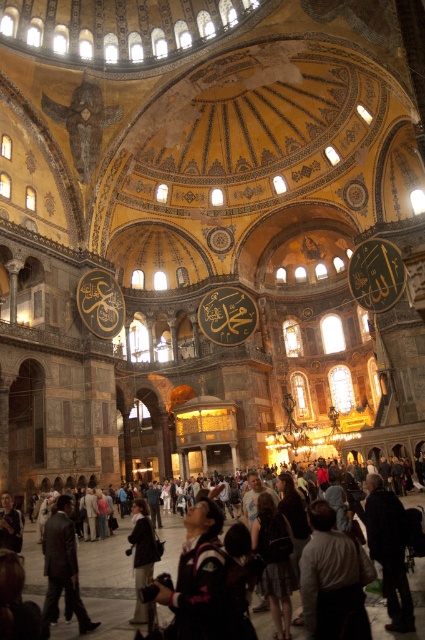
Based on the photo, you are a tour guide leading a group through the Hagia Sophia. You notice a person wearing a white cotton shirt at center and a dark clothing crowd at lower center. Can you determine which group is wider in terms of their spatial presence?

The dark clothing crowd at lower center is wider than the white cotton shirt at center.

You are standing in the Hagia Sophia and notice a white cotton shirt at center and a dark brown leather backpack at center. From your perspective, which object is positioned to the right?

The white cotton shirt at center is to the right of the dark brown leather backpack at center.

Looking at this image, you are standing in the Hagia Sophia and notice a white cotton shirt at center and a dark brown leather backpack at center. Which object is positioned higher in the scene?

The white cotton shirt at center is above the dark brown leather backpack at center, so the white cotton shirt at center is positioned higher in the scene.